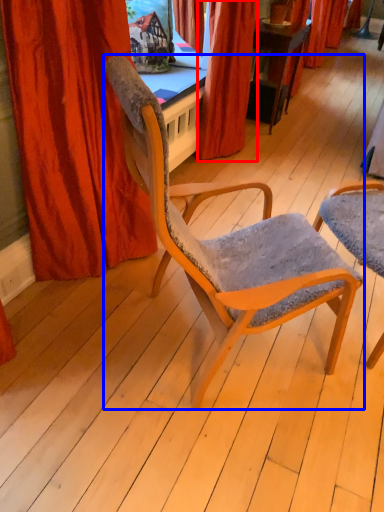
Question: Which of the following is the closest to the observer, curtain (highlighted by a red box) or chair (highlighted by a blue box)?

Choices:
 (A) curtain
 (B) chair

Answer: (B)